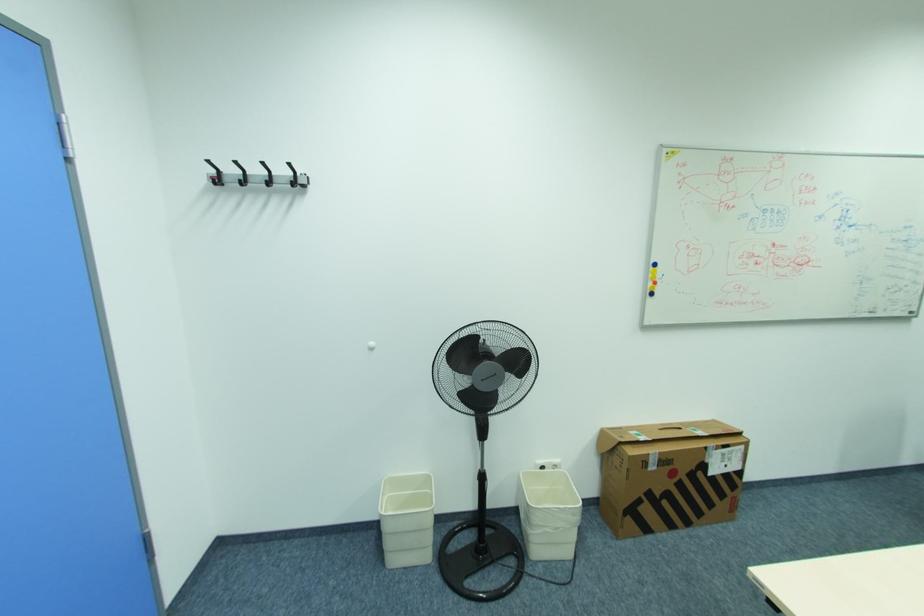
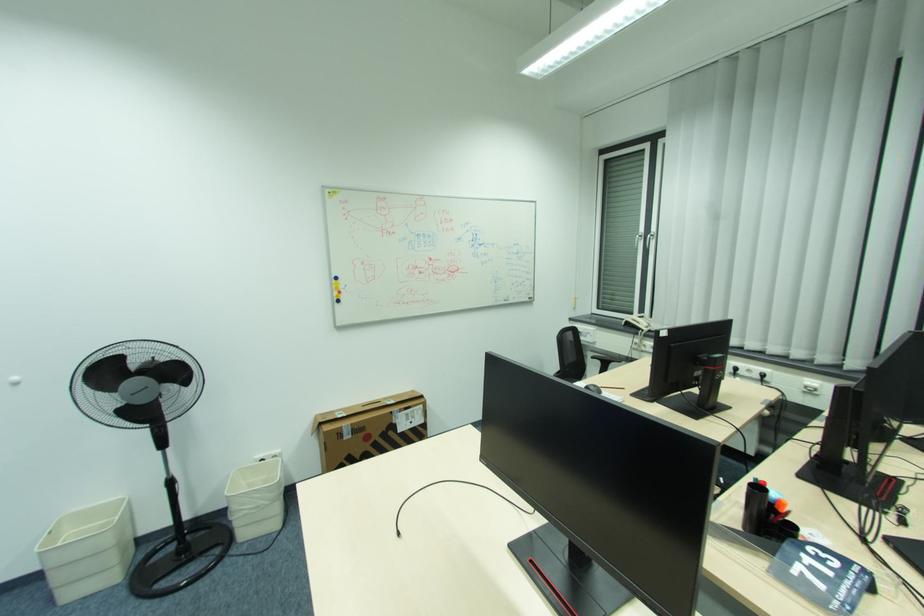
Find the pixel in the second image that matches (653,455) in the first image.

(346, 427)